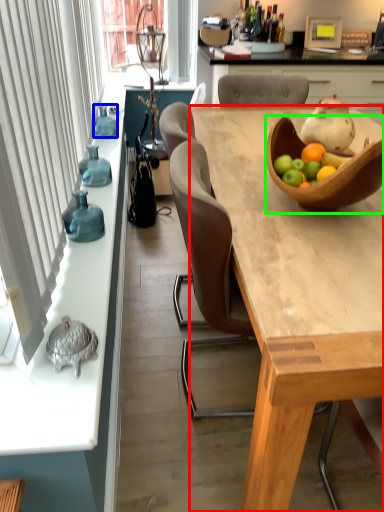
Question: Estimate the real-world distances between objects in this image. Which object is farther from desk (highlighted by a red box), bottle (highlighted by a blue box) or tableware (highlighted by a green box)?

Choices:
 (A) bottle
 (B) tableware

Answer: (A)